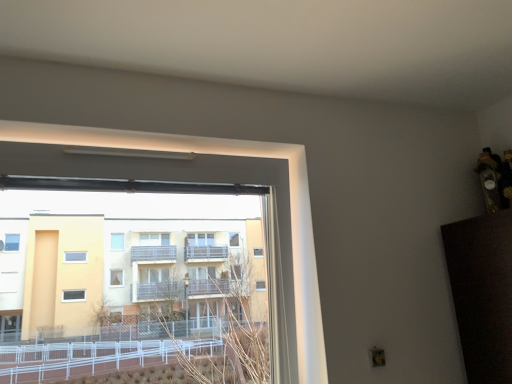
This screenshot has width=512, height=384. What do you see at coordinates (227, 155) in the screenshot?
I see `transparent glass window at left` at bounding box center [227, 155].

Where is `transparent glass window at left`? This screenshot has height=384, width=512. transparent glass window at left is located at coordinates (227, 155).

This screenshot has width=512, height=384. In order to click on transparent glass window at left in this screenshot , I will do `click(227, 155)`.